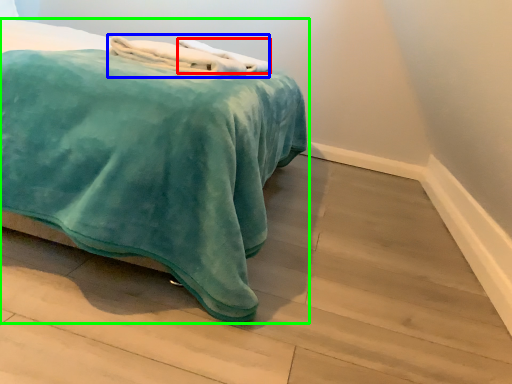
Question: Which is farther away from bath towel (highlighted by a red box)? bath towel (highlighted by a blue box) or bed (highlighted by a green box)?

Choices:
 (A) bath towel
 (B) bed

Answer: (B)